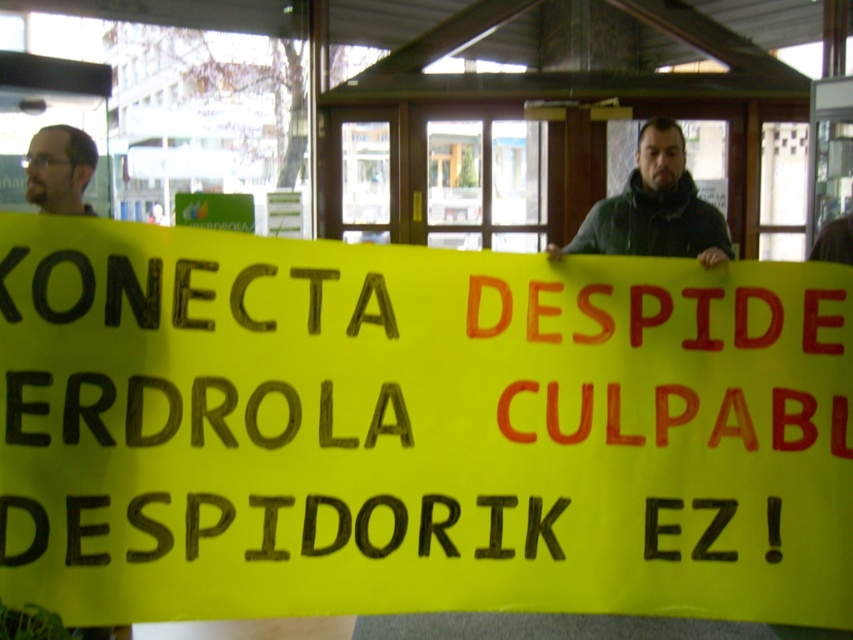
Question: Which object appears farthest from the camera in this image?

Choices:
 (A) dark green jacket at center
 (B) yellow paper sign at center

Answer: (A)

Question: Can you confirm if yellow paper sign at center is positioned below dark brown hair at upper left?

Choices:
 (A) yes
 (B) no

Answer: (A)

Question: Is dark green jacket at center bigger than dark brown hair at upper left?

Choices:
 (A) yes
 (B) no

Answer: (A)

Question: Does dark green jacket at center have a lesser width compared to dark brown hair at upper left?

Choices:
 (A) yes
 (B) no

Answer: (B)

Question: Estimate the real-world distances between objects in this image. Which object is farther from the dark green jacket at center?

Choices:
 (A) yellow paper sign at center
 (B) dark brown hair at upper left

Answer: (B)

Question: Which object is positioned farthest from the dark brown hair at upper left?

Choices:
 (A) dark green jacket at center
 (B) yellow paper sign at center

Answer: (A)